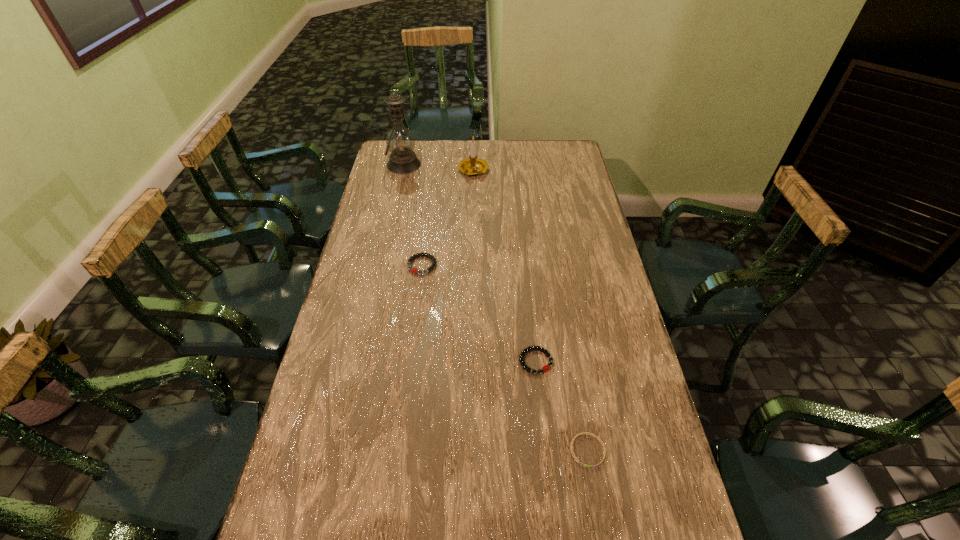
Locate an element on the screen. This screenshot has width=960, height=540. empty space between the candle holder and the oil lamp is located at coordinates (439, 168).

Find the location of a particular element. The height and width of the screenshot is (540, 960). vacant point located between the leftmost object and the second farthest bracelet is located at coordinates (469, 263).

Locate an element on the screen. This screenshot has height=540, width=960. free space that is in between the leftmost object and the rightmost object is located at coordinates (495, 307).

Identify the location of free area in between the nearest bracelet and the second nearest object. (562, 406).

You are a GUI agent. You are given a task and a screenshot of the screen. Output one action in this format:
    pyautogui.click(x=<x>, y=<y>)
    Task: Click on the closest object to the fourth object from left to right
    This screenshot has width=960, height=540.
    Given the screenshot: What is the action you would take?
    pyautogui.click(x=583, y=433)

Identify which object is the fourth nearest to the leftmost object. Please provide its 2D coordinates. Your answer should be formatted as a tuple, i.e. [(x, y)], where the tuple contains the x and y coordinates of a point satisfying the conditions above.

[(583, 433)]

Locate an element on the screen. This screenshot has height=540, width=960. the closest bracelet relative to the second nearest object is located at coordinates [583, 433].

Identify the location of bracelet that stands as the closest to the leftmost bracelet. This screenshot has width=960, height=540. (545, 368).